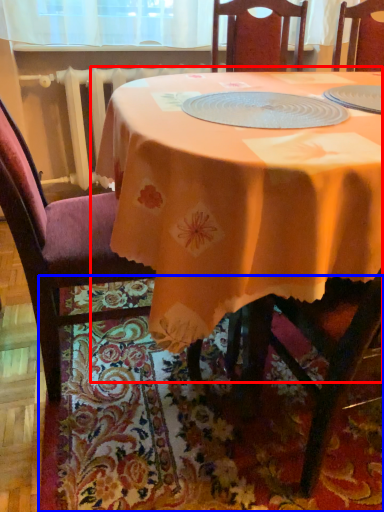
Question: Which of the following is the farthest to the observer, table (highlighted by a red box) or place mat (highlighted by a blue box)?

Choices:
 (A) table
 (B) place mat

Answer: (B)